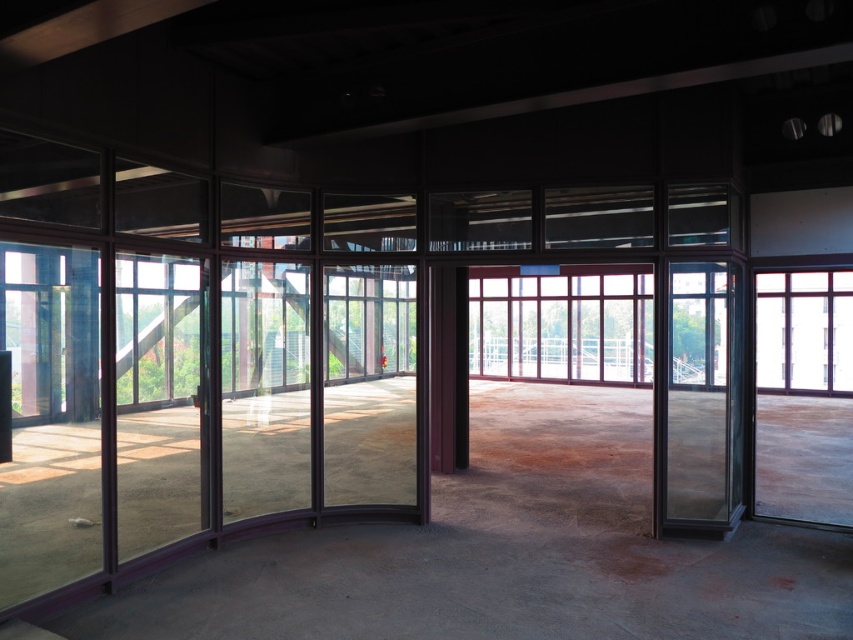
You are an architect designing a new building and want to ensure that the windows allow for maximum natural light. Given the clear glass window at center and the clear glass window at right, which window would you choose to place a large skylight above, considering their heights?

The clear glass window at right is taller than the clear glass window at center, so placing a large skylight above the clear glass window at right would be better as it has more vertical space to accommodate the skylight.

You are standing inside the modern interior space and want to exit through the transparent glass door at right. However, you notice the clear glass window at center is directly in front of you. Which object should you move to first to reach the exit?

You should move toward the clear glass window at center first since the transparent glass door at right is positioned to its right side, meaning the window is closer to your current position.

You are moving a large sofa that is 2 meters wide into the room. You need to determine which opening between the transparent glass door at right and the clear glass window at right can accommodate the sofa. Which one allows the sofa to pass through?

The clear glass window at right has a greater width than the transparent glass door at right. Since the sofa is 2 meters wide, the clear glass window at right is the only opening wide enough to allow the sofa to pass through.